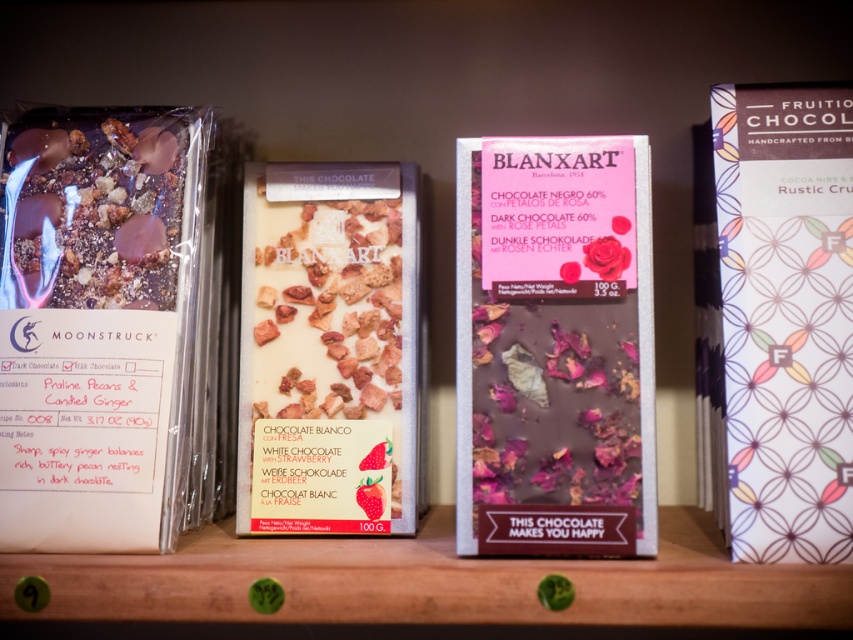
You are a customer looking at the shelf and want to grab both the matte dark chocolate bar at left and the pink matte chocolate bar at center. Which one should you reach for first if you want to pick the one closer to your hand without moving your arm?

The pink matte chocolate bar at center is closer to your hand because the matte dark chocolate bar at left is above it, meaning it is positioned higher and further away.